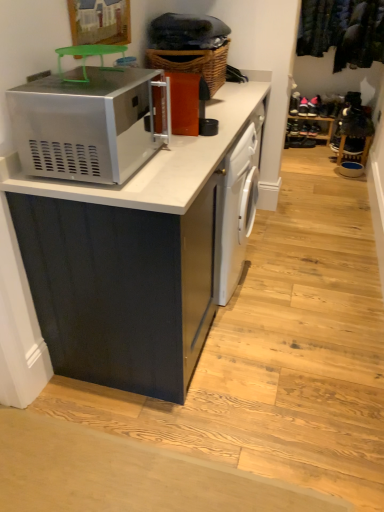
What do you see at coordinates (342, 31) in the screenshot? I see `dark green fabric at upper right` at bounding box center [342, 31].

The height and width of the screenshot is (512, 384). What do you see at coordinates (236, 207) in the screenshot?
I see `white glossy dishwasher at center` at bounding box center [236, 207].

In order to face satin silver microwave at upper left, should I rotate leftwards or rightwards?

You should look left and rotate roughly 11.350 degrees.

You are a GUI agent. You are given a task and a screenshot of the screen. Output one action in this format:
    pyautogui.click(x=<x>, y=<y>)
    Task: Click on the satin silver microwave at upper left
    
    Given the screenshot: What is the action you would take?
    pyautogui.click(x=86, y=125)

Locate an element on the screen. woven brown basket at upper center is located at coordinates (194, 65).

Is wooden shoe rack at center positioned with its back to dark green fabric at upper right?

No, wooden shoe rack at center's orientation is not away from dark green fabric at upper right.

Consider the image. Considering the sizes of objects wooden shoe rack at center and dark green fabric at upper right in the image provided, who is thinner, wooden shoe rack at center or dark green fabric at upper right?

Thinner between the two is wooden shoe rack at center.

Who is taller, wooden shoe rack at center or dark green fabric at upper right?

dark green fabric at upper right.

What's the angular difference between wooden shoe rack at center and white glossy dishwasher at center's facing directions?

The angular difference between wooden shoe rack at center and white glossy dishwasher at center is 88.6 degrees.

From a real-world perspective, between wooden shoe rack at center and white glossy dishwasher at center, who is vertically lower?

wooden shoe rack at center is physically lower.

Locate an element on the screen. The width and height of the screenshot is (384, 512). shelf below the white glossy dishwasher at center (from a real-world perspective) is located at coordinates [x=318, y=121].

Is wooden shoe rack at center wider or thinner than white glossy dishwasher at center?

In the image, wooden shoe rack at center appears to be more narrow than white glossy dishwasher at center.

From the image's perspective, is satin silver microwave at upper left above or below dark green fabric at upper right?

Clearly, from the image's perspective, satin silver microwave at upper left is below dark green fabric at upper right.

Which object is positioned more to the left, satin silver microwave at upper left or dark green fabric at upper right?

satin silver microwave at upper left is more to the left.

Does satin silver microwave at upper left lie behind dark green fabric at upper right?

No, it is in front of dark green fabric at upper right.

In the scene shown: Are satin silver microwave at upper left and dark green fabric at upper right far apart?

Yes, satin silver microwave at upper left and dark green fabric at upper right are located far from each other.

Is matte black cabinet at center closer to camera compared to white glossy dishwasher at center?

Yes, matte black cabinet at center is in front of white glossy dishwasher at center.

Could white glossy dishwasher at center be considered to be inside matte black cabinet at center?

Indeed, white glossy dishwasher at center is located within matte black cabinet at center.

Between point (15, 255) and point (227, 251), which one is positioned behind?

The point (227, 251) is farther from the camera.

In the scene shown: Considering the positions of objects matte black cabinet at center and white glossy dishwasher at center in the image provided, who is more to the right, matte black cabinet at center or white glossy dishwasher at center?

Positioned to the right is white glossy dishwasher at center.

Is satin silver microwave at upper left facing towards white glossy dishwasher at center?

No, satin silver microwave at upper left is not facing towards white glossy dishwasher at center.

Considering the relative sizes of satin silver microwave at upper left and white glossy dishwasher at center in the image provided, is satin silver microwave at upper left bigger than white glossy dishwasher at center?

No, satin silver microwave at upper left is not bigger than white glossy dishwasher at center.

Would you say satin silver microwave at upper left contains white glossy dishwasher at center?

Definitely not — white glossy dishwasher at center is not inside satin silver microwave at upper left.

At what (x,y) coordinates should I click in order to perform the action: click on shelf that appears below the dark green fabric at upper right (from a real-world perspective). Please return your answer as a coordinate pair (x, y). The image size is (384, 512). Looking at the image, I should click on (318, 121).

Between dark green fabric at upper right and wooden shoe rack at center, which one appears on the right side from the viewer's perspective?

dark green fabric at upper right.

Which point is more distant from viewer, (319, 26) or (325, 139)?

Point (325, 139)

From a real-world perspective, is white glossy dishwasher at center located beneath matte black cabinet at center?

Yes, from a real-world perspective, white glossy dishwasher at center is under matte black cabinet at center.

Which object is more forward, white glossy dishwasher at center or matte black cabinet at center?

matte black cabinet at center is closer to the camera.

What's the angular difference between white glossy dishwasher at center and matte black cabinet at center's facing directions?

They differ by 0.781 degrees in their facing directions.

Considering the sizes of objects white glossy dishwasher at center and matte black cabinet at center in the image provided, who is wider, white glossy dishwasher at center or matte black cabinet at center?

matte black cabinet at center.

The width and height of the screenshot is (384, 512). I want to click on laundry in front of the wooden shoe rack at center, so click(x=342, y=31).

Where is `shelf that is behind the white glossy dishwasher at center`? The height and width of the screenshot is (512, 384). shelf that is behind the white glossy dishwasher at center is located at coordinates (318, 121).

Based on their spatial positions, is dark green fabric at upper right or woven brown basket at upper center closer to wooden shoe rack at center?

The object closer to wooden shoe rack at center is dark green fabric at upper right.

Which object lies further to the anchor point dark green fabric at upper right, satin silver microwave at upper left or woven brown basket at upper center?

satin silver microwave at upper left is positioned further to the anchor dark green fabric at upper right.

Consider the image. From the image, which object appears to be farther from matte black cabinet at center, dark green fabric at upper right or white glossy dishwasher at center?

The object further to matte black cabinet at center is dark green fabric at upper right.

When comparing their distances from matte black cabinet at center, does wooden shoe rack at center or woven brown basket at upper center seem closer?

woven brown basket at upper center is closer to matte black cabinet at center.

Considering their positions, is dark green fabric at upper right positioned closer to satin silver microwave at upper left than matte black cabinet at center?

matte black cabinet at center is closer to satin silver microwave at upper left.

Looking at the image, which one is located closer to white glossy dishwasher at center, woven brown basket at upper center or matte black cabinet at center?

Among the two, matte black cabinet at center is located nearer to white glossy dishwasher at center.

Considering their positions, is matte black cabinet at center positioned further to white glossy dishwasher at center than satin silver microwave at upper left?

Based on the image, satin silver microwave at upper left appears to be further to white glossy dishwasher at center.

Considering their positions, is woven brown basket at upper center positioned further to satin silver microwave at upper left than white glossy dishwasher at center?

woven brown basket at upper center is positioned further to the anchor satin silver microwave at upper left.

At what (x,y) coordinates should I click in order to perform the action: click on cabinetry located between satin silver microwave at upper left and woven brown basket at upper center in the depth direction. Please return your answer as a coordinate pair (x, y). Image resolution: width=384 pixels, height=512 pixels. Looking at the image, I should click on (130, 257).

Image resolution: width=384 pixels, height=512 pixels. Find the location of `cabinetry between satin silver microwave at upper left and white glossy dishwasher at center from front to back`. cabinetry between satin silver microwave at upper left and white glossy dishwasher at center from front to back is located at coordinates (130, 257).

Image resolution: width=384 pixels, height=512 pixels. In order to click on dish washer located between matte black cabinet at center and wooden shoe rack at center in the depth direction in this screenshot , I will do `click(236, 207)`.

Identify the location of dish washer positioned between satin silver microwave at upper left and dark green fabric at upper right from near to far. The width and height of the screenshot is (384, 512). (236, 207).